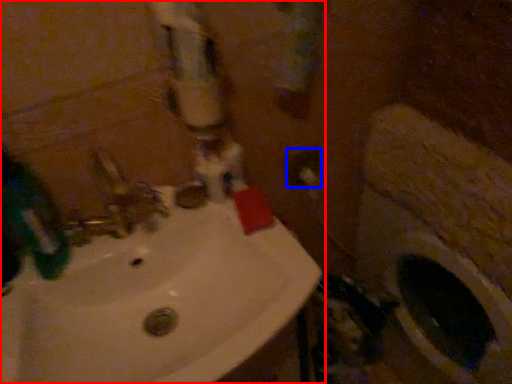
Question: Which object is closer to the camera taking this photo, sink (highlighted by a red box) or electric outlet (highlighted by a blue box)?

Choices:
 (A) sink
 (B) electric outlet

Answer: (A)